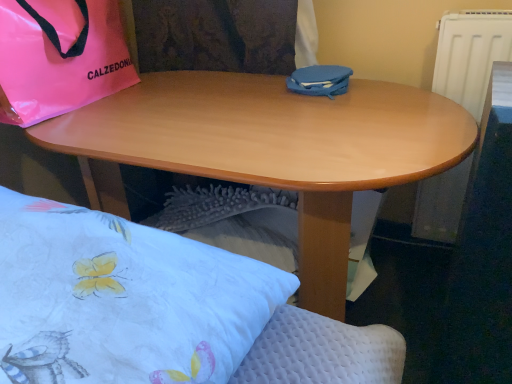
What are the coordinates of `pink glossy bag at upper left` in the screenshot? It's located at (60, 56).

In order to face blue matte case at center, should I rotate leftwards or rightwards?

To align with it, rotate right about 8.780°.

What do you see at coordinates (122, 299) in the screenshot? Image resolution: width=512 pixels, height=384 pixels. I see `white quilted pillow at lower left` at bounding box center [122, 299].

In order to click on pink glossy bag at upper left in this screenshot , I will do `click(60, 56)`.

Where is `pillow in front of the blue matte case at center`? pillow in front of the blue matte case at center is located at coordinates (122, 299).

Looking at this image, who is smaller, blue matte case at center or white quilted pillow at lower left?

blue matte case at center is smaller.

Is blue matte case at center inside the boundaries of white quilted pillow at lower left, or outside?

blue matte case at center is located beyond the bounds of white quilted pillow at lower left.

Is blue matte case at center not close to white quilted pillow at lower left?

blue matte case at center is actually quite close to white quilted pillow at lower left.

Between wooden desk at center and white quilted pillow at lower left, which one has smaller size?

Smaller between the two is white quilted pillow at lower left.

Does wooden desk at center come in front of white quilted pillow at lower left?

No.

Can you confirm if wooden desk at center is wider than white quilted pillow at lower left?

Correct, the width of wooden desk at center exceeds that of white quilted pillow at lower left.

Measure the distance from wooden desk at center to blue matte case at center.

wooden desk at center is 10.57 inches from blue matte case at center.

From a real-world perspective, is wooden desk at center positioned over blue matte case at center based on gravity?

No.

From the image's perspective, who appears lower, wooden desk at center or blue matte case at center?

wooden desk at center is shown below in the image.

Does wooden desk at center turn towards blue matte case at center?

No.

From a real-world perspective, which object rests below the other?

wooden desk at center.

Is wooden desk at center taller or shorter than pink glossy bag at upper left?

Clearly, wooden desk at center is taller compared to pink glossy bag at upper left.

Is pink glossy bag at upper left at the back of wooden desk at center?

No, pink glossy bag at upper left is not at the back of wooden desk at center.

From the picture: Is wooden desk at center completely or partially outside of pink glossy bag at upper left?

Yes, wooden desk at center is not within pink glossy bag at upper left.

What's the angular difference between white quilted pillow at lower left and pink glossy bag at upper left's facing directions?

They differ by 1.64 degrees in their facing directions.

From their relative heights in the image, would you say white quilted pillow at lower left is taller or shorter than pink glossy bag at upper left?

white quilted pillow at lower left is shorter than pink glossy bag at upper left.

Can you confirm if white quilted pillow at lower left is smaller than pink glossy bag at upper left?

Yes, white quilted pillow at lower left is smaller than pink glossy bag at upper left.

In the image, there is a pink glossy bag at upper left. Where is `pillow below it (from a real-world perspective)`? This screenshot has height=384, width=512. pillow below it (from a real-world perspective) is located at coordinates (122, 299).

Can you tell me how much pink glossy bag at upper left and white quilted pillow at lower left differ in facing direction?

pink glossy bag at upper left and white quilted pillow at lower left are facing 1.64 degrees away from each other.

Could you tell me if pink glossy bag at upper left is turned towards white quilted pillow at lower left?

Result: No, pink glossy bag at upper left is not aimed at white quilted pillow at lower left.

Between point (117, 59) and point (58, 340), which one is positioned in front?

Positioned in front is point (58, 340).

Is pink glossy bag at upper left in contact with white quilted pillow at lower left?

No, pink glossy bag at upper left is not beside white quilted pillow at lower left.

Which object is positioned more to the left, white quilted pillow at lower left or wooden desk at center?

white quilted pillow at lower left is more to the left.

Are white quilted pillow at lower left and wooden desk at center making contact?

No, white quilted pillow at lower left is not next to wooden desk at center.

From a real-world perspective, between white quilted pillow at lower left and wooden desk at center, who is vertically lower?

wooden desk at center is physically lower.

Image resolution: width=512 pixels, height=384 pixels. In order to click on pillow lying in front of the wooden desk at center in this screenshot , I will do `click(122, 299)`.

Identify the location of pillow below the blue matte case at center (from a real-world perspective). The height and width of the screenshot is (384, 512). (122, 299).

You are a GUI agent. You are given a task and a screenshot of the screen. Output one action in this format:
    pyautogui.click(x=<x>, y=<y>)
    Task: Click on the pillow below the wooden desk at center (from the image's perspective)
    Image resolution: width=512 pixels, height=384 pixels.
    Given the screenshot: What is the action you would take?
    pyautogui.click(x=122, y=299)

Considering their positions, is blue matte case at center positioned further to pink glossy bag at upper left than white quilted pillow at lower left?

white quilted pillow at lower left is positioned further to the anchor pink glossy bag at upper left.

Considering their positions, is wooden desk at center positioned further to pink glossy bag at upper left than blue matte case at center?

blue matte case at center is positioned further to the anchor pink glossy bag at upper left.

In the scene shown: Based on their spatial positions, is pink glossy bag at upper left or wooden desk at center closer to blue matte case at center?

wooden desk at center is closer to blue matte case at center.

Looking at the image, which one is located closer to blue matte case at center, white quilted pillow at lower left or pink glossy bag at upper left?

The object closer to blue matte case at center is pink glossy bag at upper left.

Estimate the real-world distances between objects in this image. Which object is further from white quilted pillow at lower left, pink glossy bag at upper left or blue matte case at center?

blue matte case at center is further to white quilted pillow at lower left.

Considering their positions, is pink glossy bag at upper left positioned closer to blue matte case at center than white quilted pillow at lower left?

The object closer to blue matte case at center is pink glossy bag at upper left.

From the picture: When comparing their distances from wooden desk at center, does white quilted pillow at lower left or blue matte case at center seem further?

The object further to wooden desk at center is white quilted pillow at lower left.

Looking at the image, which one is located further to blue matte case at center, white quilted pillow at lower left or wooden desk at center?

Based on the image, white quilted pillow at lower left appears to be further to blue matte case at center.

Locate an element on the screen. The width and height of the screenshot is (512, 384). desk between pink glossy bag at upper left and blue matte case at center from left to right is located at coordinates (x=269, y=149).

Locate an element on the screen. The width and height of the screenshot is (512, 384). desk between white quilted pillow at lower left and blue matte case at center in the front-back direction is located at coordinates (269, 149).

This screenshot has height=384, width=512. Identify the location of pillow located between pink glossy bag at upper left and wooden desk at center in the left-right direction. (122, 299).

Where is `pillow between pink glossy bag at upper left and blue matte case at center from left to right`? pillow between pink glossy bag at upper left and blue matte case at center from left to right is located at coordinates (122, 299).